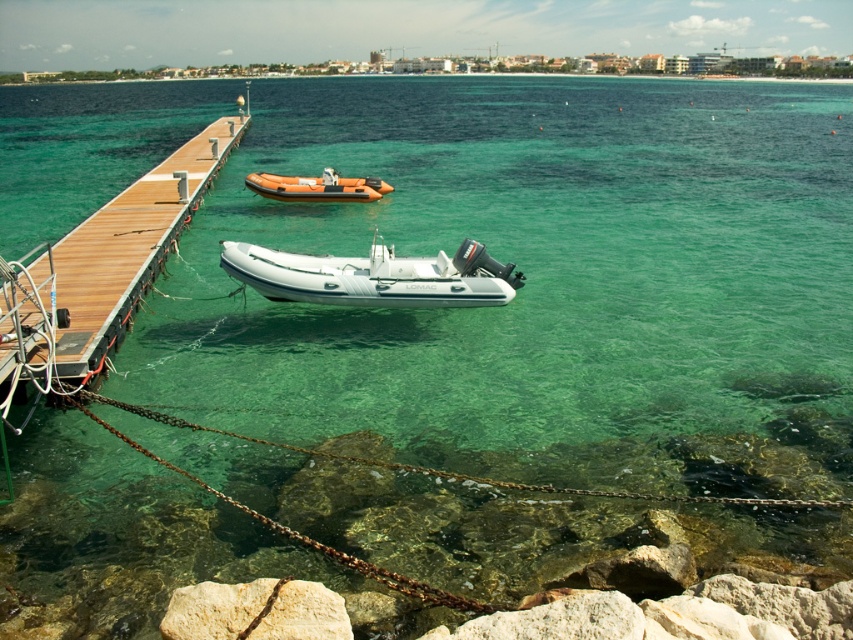
Question: Is white rubber boat at center to the left of white smooth rock at lower center from the viewer's perspective?

Choices:
 (A) no
 (B) yes

Answer: (A)

Question: Which of the following is the farthest from the observer?

Choices:
 (A) wooden dock at left
 (B) white smooth rock at lower center

Answer: (A)

Question: In this image, where is white rubber boat at center located relative to orange rubber dinghy at center?

Choices:
 (A) right
 (B) left

Answer: (A)

Question: Which object is positioned closest to the wooden dock at left?

Choices:
 (A) white smooth rock at lower center
 (B) white rubber boat at center
 (C) orange rubber dinghy at center

Answer: (B)

Question: Which of the following is the closest to the observer?

Choices:
 (A) (15, 294)
 (B) (404, 278)
 (C) (276, 184)
 (D) (184, 596)

Answer: (D)

Question: Does wooden dock at left have a greater width compared to white rubber boat at center?

Choices:
 (A) yes
 (B) no

Answer: (A)